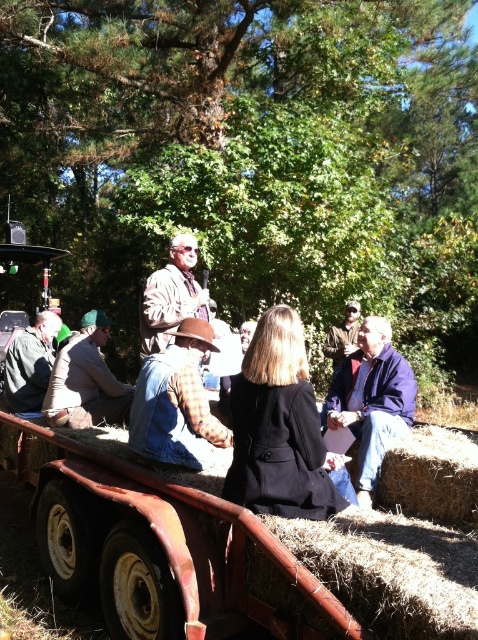
Question: Does blue denim jacket at lower right appear on the left side of brown leather hat at center?

Choices:
 (A) yes
 (B) no

Answer: (B)

Question: Based on their relative distances, which object is nearer to the denim jacket at lower left?

Choices:
 (A) brown leather hat at center
 (B) khaki cotton shirt at center
 (C) brown denim vest at center

Answer: (A)

Question: Does blue denim jacket at lower right appear over brown leather hat at center?

Choices:
 (A) no
 (B) yes

Answer: (A)

Question: Which object appears farthest from the camera in this image?

Choices:
 (A) brown denim jacket at center
 (B) brown denim vest at center
 (C) denim jacket at lower left

Answer: (C)

Question: Which of the following is the farthest from the observer?

Choices:
 (A) denim jacket at lower left
 (B) brown denim jacket at center

Answer: (A)

Question: Can you confirm if blue denim jacket at lower right is thinner than brown denim jacket at center?

Choices:
 (A) yes
 (B) no

Answer: (A)